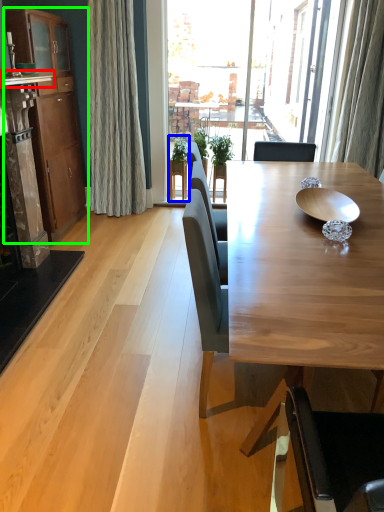
Question: Considering the real-world distances, which object is farthest from counter top (highlighted by a red box)? houseplant (highlighted by a blue box) or cabinetry (highlighted by a green box)?

Choices:
 (A) houseplant
 (B) cabinetry

Answer: (A)